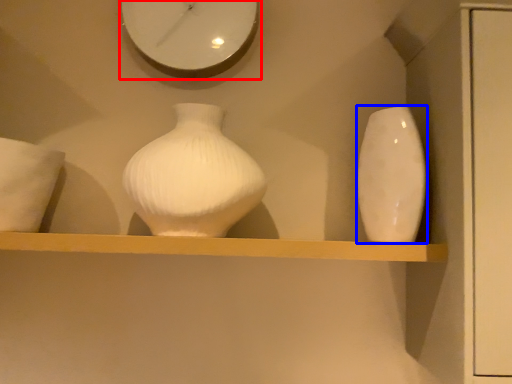
Question: Which object is closer to the camera taking this photo, clock (highlighted by a red box) or vase (highlighted by a blue box)?

Choices:
 (A) clock
 (B) vase

Answer: (B)